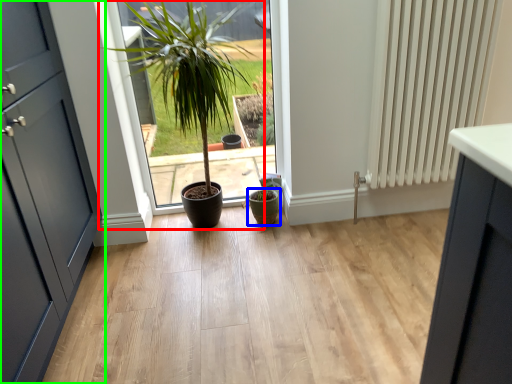
Question: Which is farther away from houseplant (highlighted by a red box)? flowerpot (highlighted by a blue box) or door (highlighted by a green box)?

Choices:
 (A) flowerpot
 (B) door

Answer: (A)